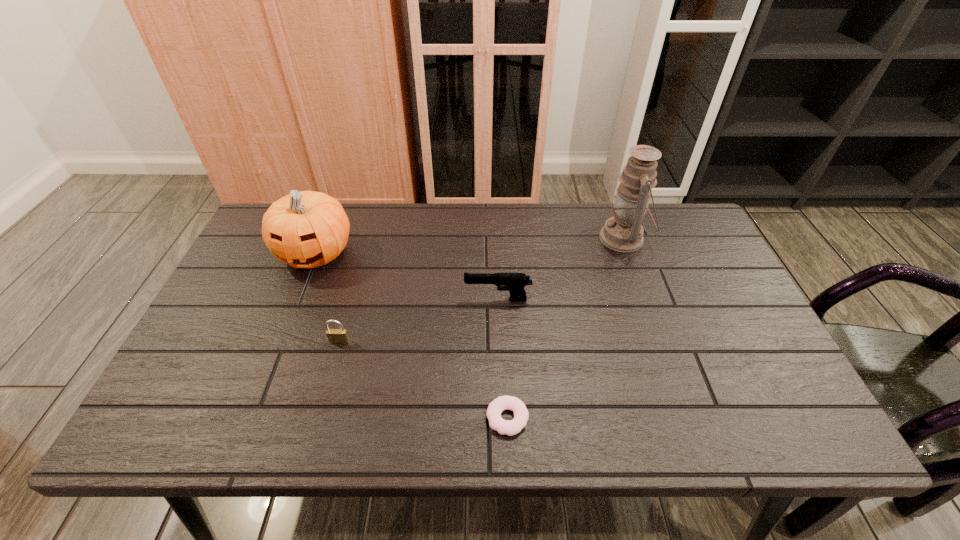
Identify the location of free point between the padlock and the oil lamp. (482, 290).

Where is `free space that is in between the tallest object and the pistol`? The width and height of the screenshot is (960, 540). free space that is in between the tallest object and the pistol is located at coordinates (561, 269).

At what (x,y) coordinates should I click in order to perform the action: click on free spot between the oil lamp and the shortest object. Please return your answer as a coordinate pair (x, y). Looking at the image, I should click on (565, 328).

The width and height of the screenshot is (960, 540). In order to click on free space between the fourth shortest object and the pistol in this screenshot , I will do `click(406, 276)`.

At what (x,y) coordinates should I click in order to perform the action: click on vacant space that is in between the third tallest object and the leftmost object. Please return your answer as a coordinate pair (x, y). Looking at the image, I should click on (406, 276).

I want to click on vacant area that lies between the fourth shortest object and the fourth tallest object, so click(327, 298).

Find the location of a particular element. The height and width of the screenshot is (540, 960). vacant region between the second tallest object and the tallest object is located at coordinates (469, 246).

Locate which object is the fourth closest to the pistol. Please provide its 2D coordinates. Your answer should be formatted as a tuple, i.e. [(x, y)], where the tuple contains the x and y coordinates of a point satisfying the conditions above.

[(306, 229)]

Identify which object is the third nearest to the doughnut. Please provide its 2D coordinates. Your answer should be formatted as a tuple, i.e. [(x, y)], where the tuple contains the x and y coordinates of a point satisfying the conditions above.

[(623, 232)]

At what (x,y) coordinates should I click in order to perform the action: click on vacant position in the image that satisfies the following two spatial constraints: 1. on the front-facing side of the third farthest object; 2. on the front-facing side of the fourth farthest object. Please return your answer as a coordinate pair (x, y). This screenshot has height=540, width=960. Looking at the image, I should click on (499, 341).